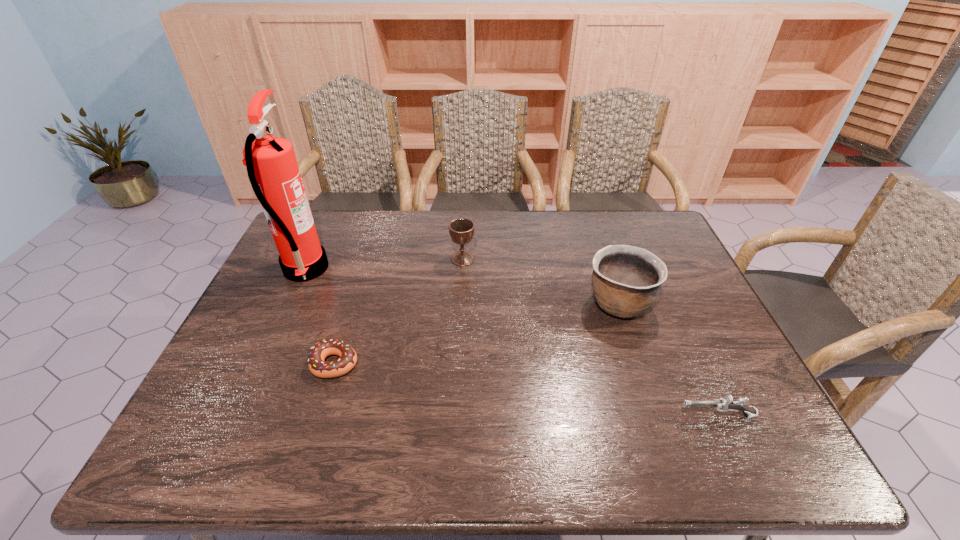
This screenshot has width=960, height=540. Find the location of `vacant point located on the left of the third object from left to right`. vacant point located on the left of the third object from left to right is located at coordinates (425, 259).

Locate an element on the screen. Image resolution: width=960 pixels, height=540 pixels. free location located aimed along the barrel of the second shortest object is located at coordinates (503, 415).

You are a GUI agent. You are given a task and a screenshot of the screen. Output one action in this format:
    pyautogui.click(x=<x>, y=<y>)
    Task: Click on the vacant region located aimed along the barrel of the second shortest object
    This screenshot has width=960, height=540.
    Given the screenshot: What is the action you would take?
    pyautogui.click(x=516, y=415)

You are a GUI agent. You are given a task and a screenshot of the screen. Output one action in this format:
    pyautogui.click(x=<x>, y=<y>)
    Task: Click on the free region located 0.140m aimed along the barrel of the second shortest object
    The height and width of the screenshot is (540, 960).
    Given the screenshot: What is the action you would take?
    pyautogui.click(x=615, y=415)

Where is `vacant space located 0.070m on the front of the shortest object`? vacant space located 0.070m on the front of the shortest object is located at coordinates (322, 407).

I want to click on object present at the far edge, so click(x=271, y=164).

The height and width of the screenshot is (540, 960). I want to click on object that is at the left edge, so click(x=271, y=164).

Find the location of a particular element. Image resolution: width=960 pixels, height=540 pixels. pottery located in the right edge section of the desktop is located at coordinates click(x=626, y=280).

Locate an element on the screen. This screenshot has height=540, width=960. gun present at the right edge is located at coordinates (725, 404).

Identify the location of object at the far left corner. (271, 164).